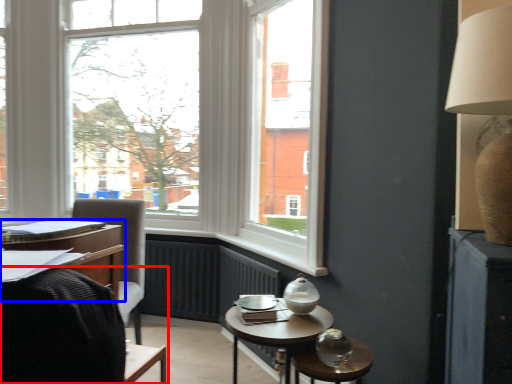
Question: Which point is further to the camera, chair (highlighted by a red box) or desk (highlighted by a blue box)?

Choices:
 (A) chair
 (B) desk

Answer: (A)